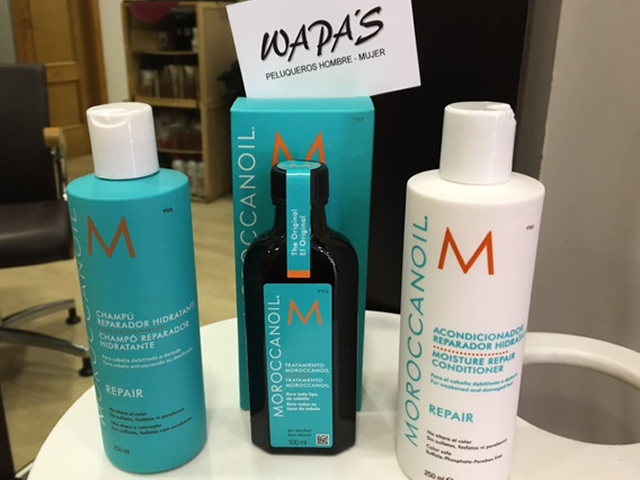
Find the location of a particular element. The height and width of the screenshot is (480, 640). shelves is located at coordinates (185, 165), (180, 140), (166, 78), (166, 41).